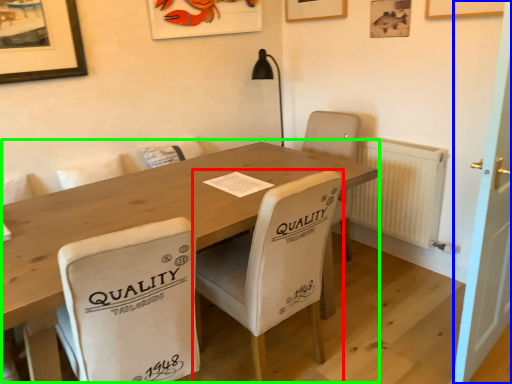
Question: Estimate the real-world distances between objects in this image. Which object is closer to chair (highlighted by a red box), door (highlighted by a blue box) or table (highlighted by a green box)?

Choices:
 (A) door
 (B) table

Answer: (B)